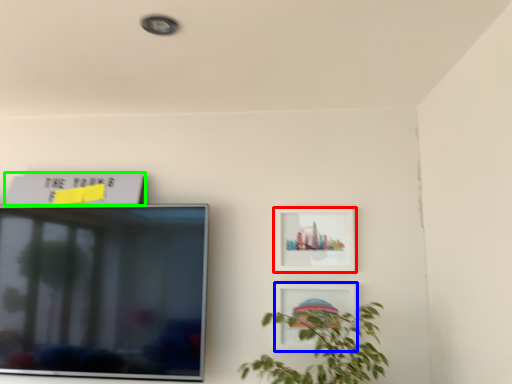
Question: Considering the real-world distances, which object is farthest from picture frame (highlighted by a red box)? picture frame (highlighted by a blue box) or picture frame (highlighted by a green box)?

Choices:
 (A) picture frame
 (B) picture frame

Answer: (B)